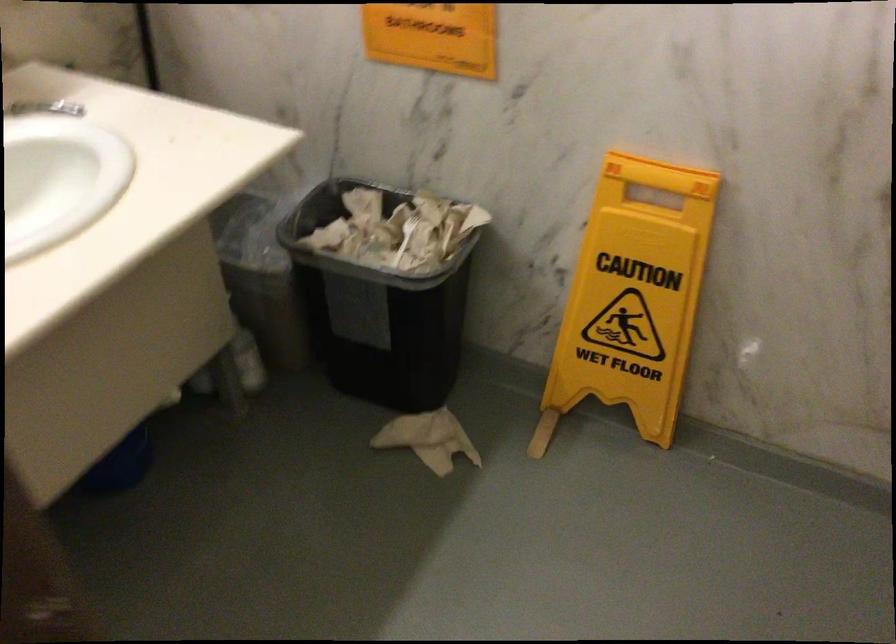
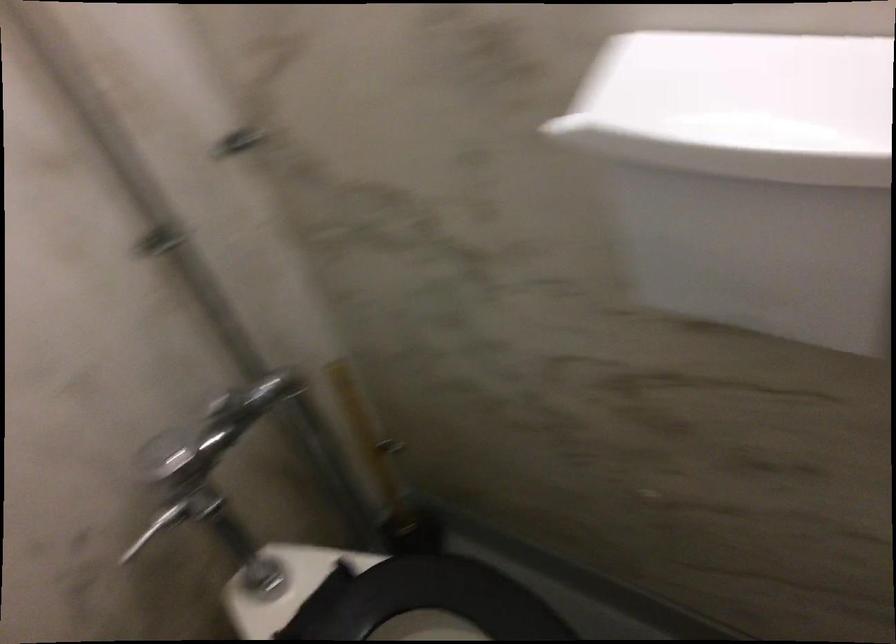
The first image is from the beginning of the video and the second image is from the end. How did the camera likely rotate when shooting the video?

The camera's rotation is toward left-down.